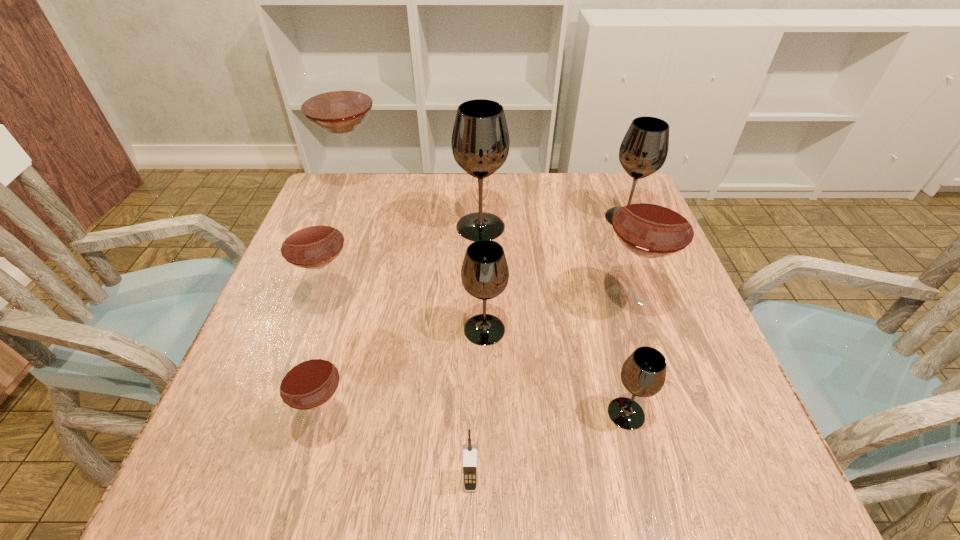
You are a GUI agent. You are given a task and a screenshot of the screen. Output one action in this format:
    pyautogui.click(x=<x>, y=<y>)
    Task: Click on the vacant area that lies between the second nearest gray wineglass and the nearest red wineglass
    
    Given the screenshot: What is the action you would take?
    407,377

Where is `free space between the nearest gray wineglass and the biggest red wineglass`? Image resolution: width=960 pixels, height=540 pixels. free space between the nearest gray wineglass and the biggest red wineglass is located at coordinates (492, 301).

Find the location of `free space between the farthest red wineglass and the biggest gray wineglass`. free space between the farthest red wineglass and the biggest gray wineglass is located at coordinates (419, 208).

This screenshot has height=540, width=960. Identify the location of free space between the nearest gray wineglass and the nearest red wineglass. (477, 418).

Identify the location of object that is the fifth closest to the biggest gray wineglass. click(644, 148).

The height and width of the screenshot is (540, 960). Find the location of `the fourth closest object to the second biggest gray wineglass`. the fourth closest object to the second biggest gray wineglass is located at coordinates (x=643, y=373).

Identify the location of wineglass that is the sixth closest to the third biggest red wineglass. (643, 373).

You are a GUI agent. You are given a task and a screenshot of the screen. Output one action in this format:
    pyautogui.click(x=<x>, y=<y>)
    Task: Click on the wineglass that can be found as the closest to the third farthest gray wineglass
    This screenshot has width=960, height=540.
    Given the screenshot: What is the action you would take?
    pyautogui.click(x=654, y=219)

Select which red wineglass appears as the closest to the biggest gray wineglass. Please provide its 2D coordinates. Your answer should be formatted as a tuple, i.e. [(x, y)], where the tuple contains the x and y coordinates of a point satisfying the conditions above.

[(336, 99)]

Identify the location of red wineglass object that ranks as the third closest to the second smallest red wineglass. (654, 219).